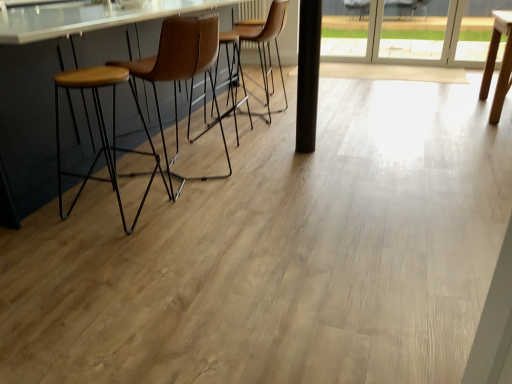
Where is `vacant area that lies between brown leather stool at left, the first chair when ordered from front to back, and brown leather chair at center, which is the second chair in front-to-back order`? The height and width of the screenshot is (384, 512). vacant area that lies between brown leather stool at left, the first chair when ordered from front to back, and brown leather chair at center, which is the second chair in front-to-back order is located at coordinates (227, 132).